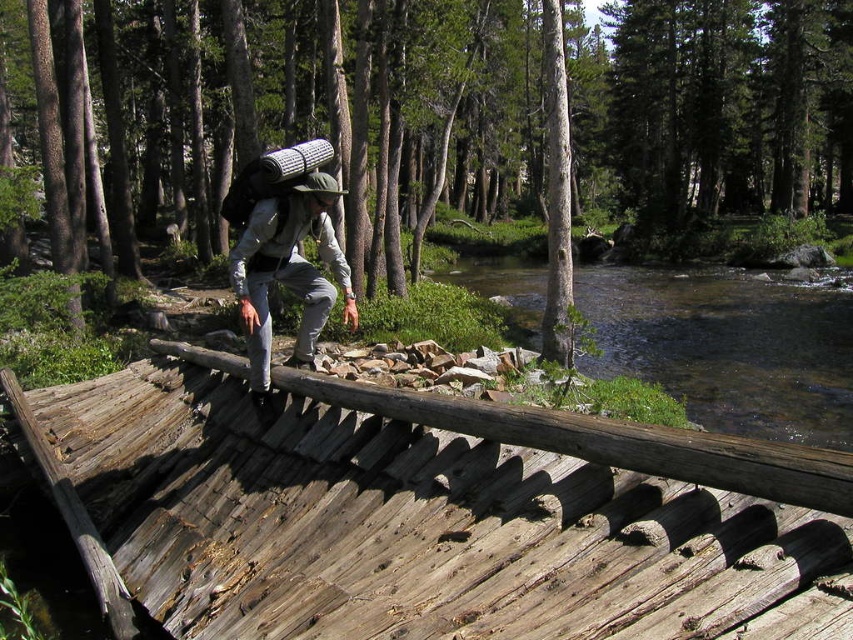
Is weathered wood bridge at center positioned in front of clear water at river right?

Yes, it is in front of clear water at river right.

Which is below, weathered wood bridge at center or clear water at river right?

Positioned lower is weathered wood bridge at center.

What do you see at coordinates (428, 513) in the screenshot?
I see `weathered wood bridge at center` at bounding box center [428, 513].

At what (x,y) coordinates should I click in order to perform the action: click on weathered wood bridge at center. Please return your answer as a coordinate pair (x, y). The width and height of the screenshot is (853, 640). Looking at the image, I should click on (428, 513).

Between green matte forest at center and gray fabric backpack at center, which one has less height?

Standing shorter between the two is gray fabric backpack at center.

Measure the distance between point [51,104] and camera.

The distance of point [51,104] from camera is 44.84 feet.

Locate an element on the screen. The width and height of the screenshot is (853, 640). green matte forest at center is located at coordinates click(x=712, y=108).

Is weathered wood bridge at center below gray fabric backpack at center?

Yes.

Is point (169, 355) positioned in front of point (263, 317)?

No.

Between point (630, 452) and point (254, 312), which one is positioned behind?

Point (254, 312)

At what (x,y) coordinates should I click in order to perform the action: click on weathered wood bridge at center. Please return your answer as a coordinate pair (x, y). Image resolution: width=853 pixels, height=640 pixels. Looking at the image, I should click on (428, 513).